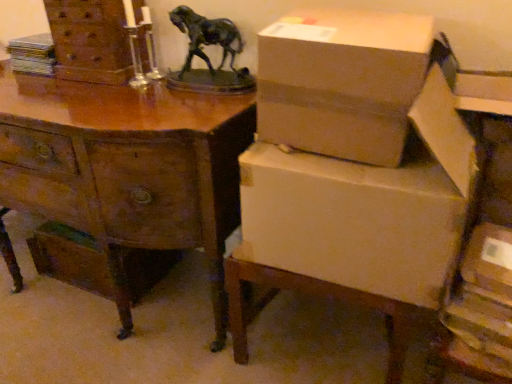
Where is `empty space that is ontop of wooden desk at center (from a real-world perspective)`? The height and width of the screenshot is (384, 512). empty space that is ontop of wooden desk at center (from a real-world perspective) is located at coordinates (81, 91).